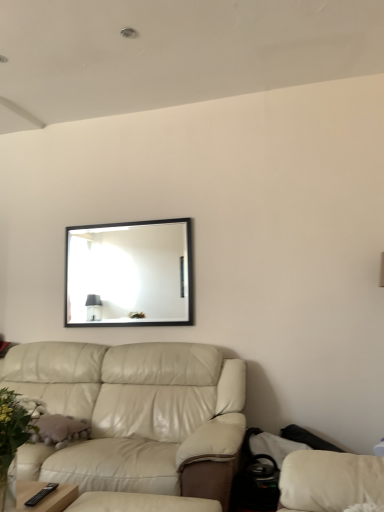
Question: Is green leafy plant at lower left far away from leather couch at lower left?

Choices:
 (A) no
 (B) yes

Answer: (A)

Question: From a real-world perspective, is green leafy plant at lower left physically above leather couch at lower left?

Choices:
 (A) yes
 (B) no

Answer: (A)

Question: Could leather couch at lower left be considered to be inside green leafy plant at lower left?

Choices:
 (A) yes
 (B) no

Answer: (B)

Question: Considering the relative sizes of green leafy plant at lower left and leather couch at lower left in the image provided, is green leafy plant at lower left shorter than leather couch at lower left?

Choices:
 (A) yes
 (B) no

Answer: (A)

Question: Does green leafy plant at lower left have a smaller size compared to leather couch at lower left?

Choices:
 (A) no
 (B) yes

Answer: (B)

Question: From the image's perspective, is leather couch at lower left positioned above or below green leafy plant at lower left?

Choices:
 (A) below
 (B) above

Answer: (A)

Question: Does point (158, 441) appear closer or farther from the camera than point (9, 400)?

Choices:
 (A) farther
 (B) closer

Answer: (A)

Question: Visually, is leather couch at lower left positioned to the left or to the right of green leafy plant at lower left?

Choices:
 (A) left
 (B) right

Answer: (B)

Question: Is leather couch at lower left bigger or smaller than green leafy plant at lower left?

Choices:
 (A) big
 (B) small

Answer: (A)

Question: From the image's perspective, is green leafy plant at lower left positioned above or below black framed mirror at upper center?

Choices:
 (A) below
 (B) above

Answer: (A)

Question: Based on their positions, is green leafy plant at lower left located to the left or right of black framed mirror at upper center?

Choices:
 (A) right
 (B) left

Answer: (B)

Question: Considering the positions of green leafy plant at lower left and black framed mirror at upper center in the image, is green leafy plant at lower left bigger or smaller than black framed mirror at upper center?

Choices:
 (A) small
 (B) big

Answer: (B)

Question: In terms of height, does green leafy plant at lower left look taller or shorter compared to black framed mirror at upper center?

Choices:
 (A) tall
 (B) short

Answer: (B)

Question: Is leather couch at lower left situated inside black framed mirror at upper center or outside?

Choices:
 (A) outside
 (B) inside

Answer: (A)

Question: Is leather couch at lower left to the left or to the right of black framed mirror at upper center in the image?

Choices:
 (A) right
 (B) left

Answer: (B)